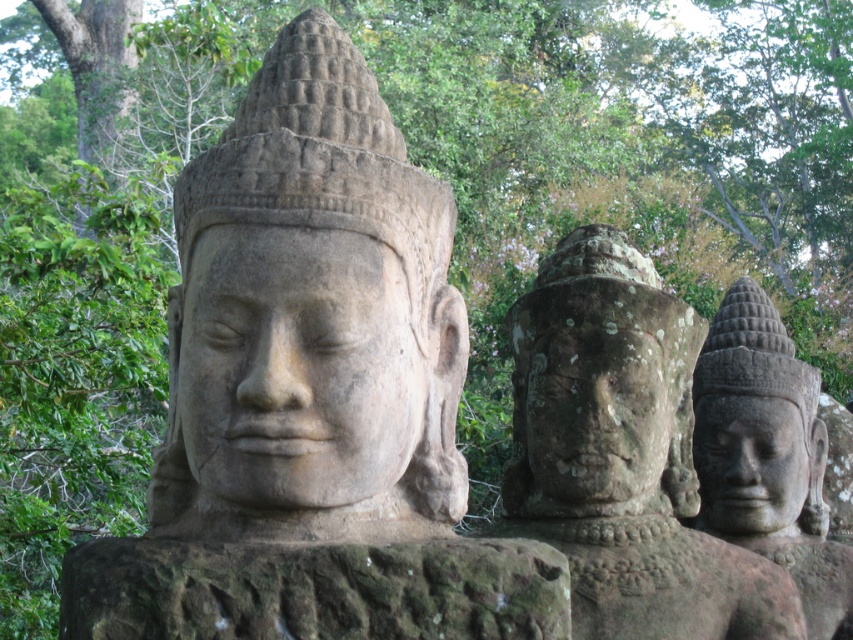
Based on the photo, which is above, gray stone statue at center or green mossy rock at center?

gray stone statue at center is above.

Consider the image. Does gray stone statue at center have a larger size compared to green mossy rock at center?

Actually, gray stone statue at center might be smaller than green mossy rock at center.

Who is more forward, (368, 433) or (456, 595)?

Point (456, 595) is more forward.

Find the location of a particular element. The width and height of the screenshot is (853, 640). gray stone statue at center is located at coordinates coord(297,368).

From the picture: Who is shorter, green mossy rock at center or gray stone face at right?

green mossy rock at center

Between green mossy rock at center and gray stone face at right, which one appears on the left side from the viewer's perspective?

green mossy rock at center

Does point (535, 579) come farther from viewer compared to point (775, 522)?

No, (535, 579) is closer to viewer.

At what (x,y) coordinates should I click in order to perform the action: click on green mossy rock at center. Please return your answer as a coordinate pair (x, y). Image resolution: width=853 pixels, height=640 pixels. Looking at the image, I should click on (314, 589).

Which is more to the left, carved stone face at center or gray stone face at right?

From the viewer's perspective, carved stone face at center appears more on the left side.

Describe the element at coordinates (587, 417) in the screenshot. I see `carved stone face at center` at that location.

Find the location of `carved stone face at center`. carved stone face at center is located at coordinates (587, 417).

Find the location of a particular element. carved stone face at center is located at coordinates (587, 417).